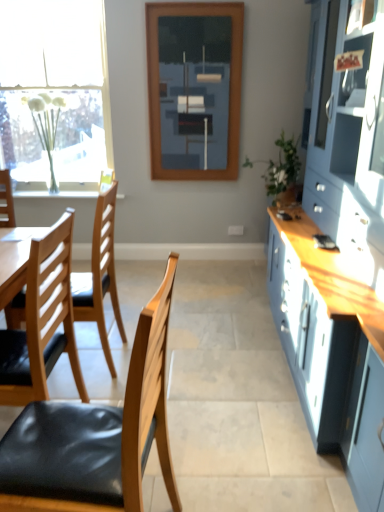
Question: From the image's perspective, is green leafy plant at right located beneath white frosted glass vase at left?

Choices:
 (A) yes
 (B) no

Answer: (A)

Question: Is green leafy plant at right oriented towards white frosted glass vase at left?

Choices:
 (A) yes
 (B) no

Answer: (A)

Question: Is green leafy plant at right to the right of white frosted glass vase at left from the viewer's perspective?

Choices:
 (A) no
 (B) yes

Answer: (B)

Question: Can you confirm if green leafy plant at right is taller than white frosted glass vase at left?

Choices:
 (A) yes
 (B) no

Answer: (B)

Question: Is green leafy plant at right positioned with its back to white frosted glass vase at left?

Choices:
 (A) no
 (B) yes

Answer: (A)

Question: Does green leafy plant at right touch white frosted glass vase at left?

Choices:
 (A) no
 (B) yes

Answer: (A)

Question: Is black glossy mobile phone at right positioned with its back to black leather chair at left, the first chair when ordered from front to back?

Choices:
 (A) yes
 (B) no

Answer: (B)

Question: Is black glossy mobile phone at right positioned beyond the bounds of black leather chair at left, the first chair when ordered from front to back?

Choices:
 (A) no
 (B) yes

Answer: (B)

Question: Does black glossy mobile phone at right come behind black leather chair at left, the 2th chair when ordered from back to front?

Choices:
 (A) no
 (B) yes

Answer: (B)

Question: Could you tell me if black glossy mobile phone at right is turned towards black leather chair at left, the first chair when ordered from front to back?

Choices:
 (A) yes
 (B) no

Answer: (B)

Question: Is black glossy mobile phone at right surrounding black leather chair at left, the first chair when ordered from front to back?

Choices:
 (A) no
 (B) yes

Answer: (A)

Question: Does black glossy mobile phone at right have a lesser height compared to black leather chair at left, the 2th chair when ordered from back to front?

Choices:
 (A) no
 (B) yes

Answer: (B)

Question: From the image's perspective, is white frosted glass vase at left under wooden chair with black seat cushion at left, which appears as the 2th chair when viewed from the front?

Choices:
 (A) yes
 (B) no

Answer: (B)